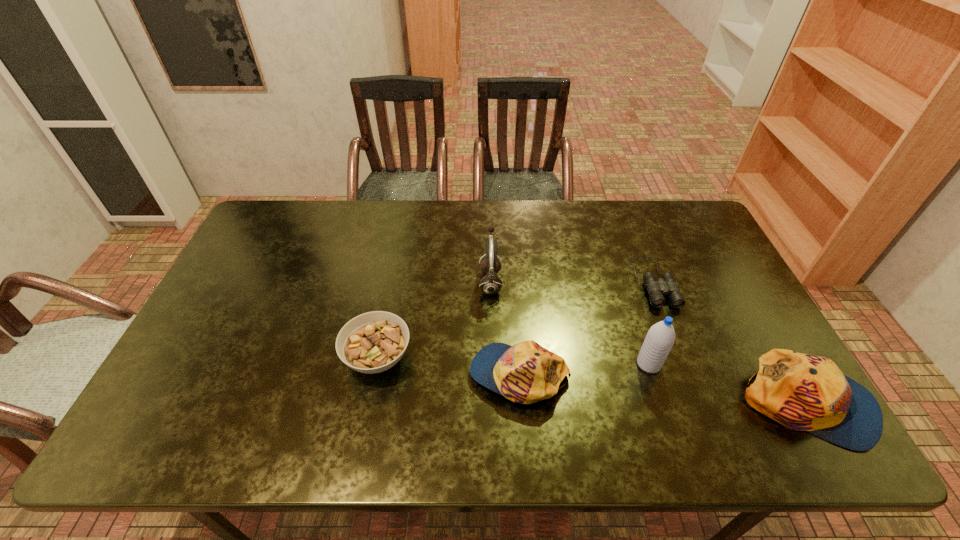
I want to click on free space for a new cap on the left, so click(260, 347).